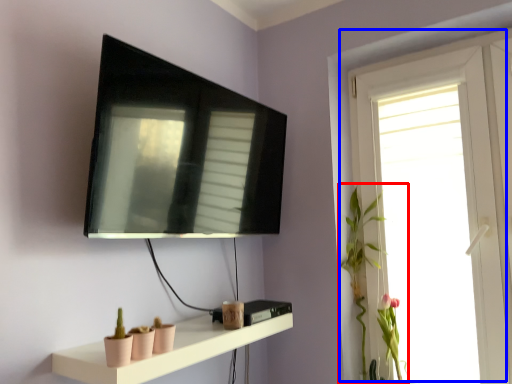
Question: Which of the following is the closest to the observer, plant (highlighted by a red box) or window (highlighted by a blue box)?

Choices:
 (A) plant
 (B) window

Answer: (B)